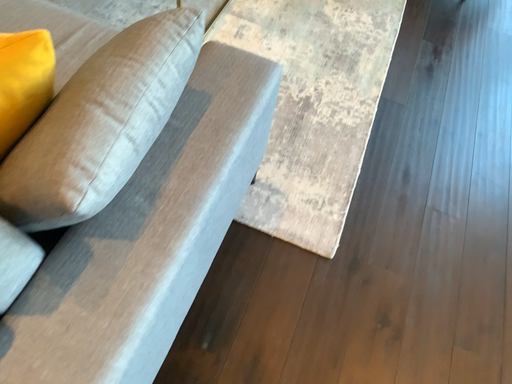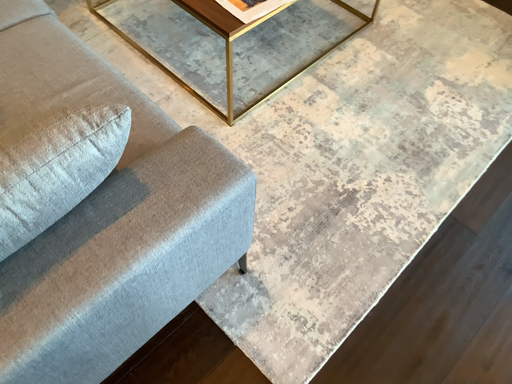
Question: Which way did the camera rotate in the video?

Choices:
 (A) rotated left
 (B) rotated right

Answer: (A)